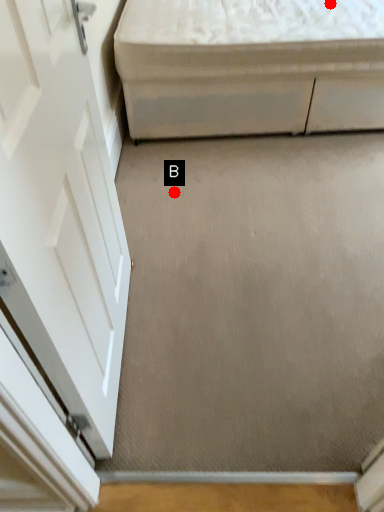
Question: Two points are circled on the image, labeled by A and B beside each circle. Which point is closer to the camera taking this photo?

Choices:
 (A) A is closer
 (B) B is closer

Answer: (A)